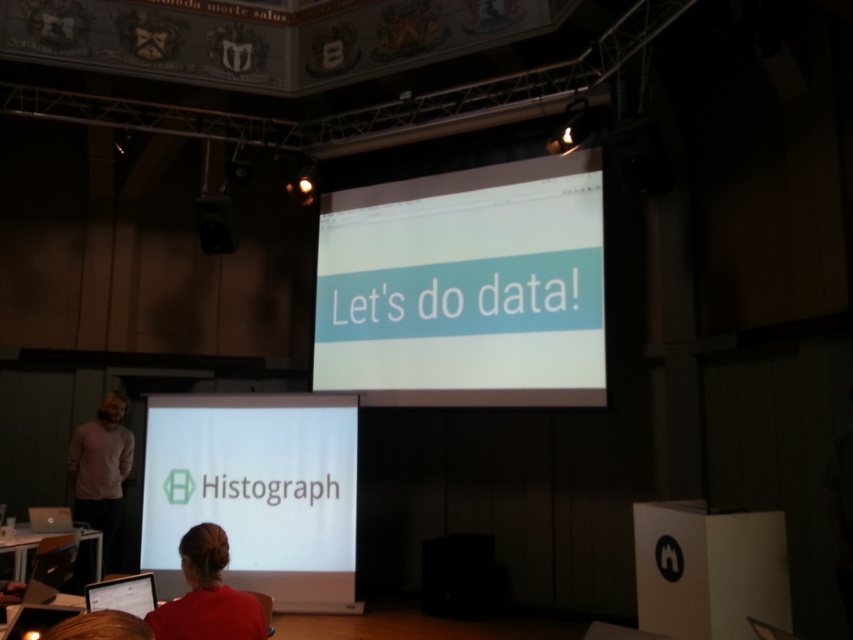
Question: Does white matte projection screen at center appear under matte black laptop at lower left?

Choices:
 (A) no
 (B) yes

Answer: (B)

Question: Estimate the real-world distances between objects in this image. Which object is closer to the white matte projection screen at center?

Choices:
 (A) light brown sweater at left
 (B) white glossy projector screen at center

Answer: (A)

Question: Estimate the real-world distances between objects in this image. Which object is farther from the black plastic speaker at upper center?

Choices:
 (A) blonde hair at lower left
 (B) light brown sweater at left

Answer: (A)

Question: Is light brown sweater at left smaller than matte black laptop at lower left?

Choices:
 (A) no
 (B) yes

Answer: (A)

Question: Which of the following is the farthest from the observer?

Choices:
 (A) matte black laptop at lower left
 (B) white glossy projector screen at center
 (C) red fabric shirt at lower center
 (D) black plastic speaker at upper center

Answer: (D)

Question: Is white glossy projector screen at center closer to camera compared to matte black laptop at lower left?

Choices:
 (A) no
 (B) yes

Answer: (A)